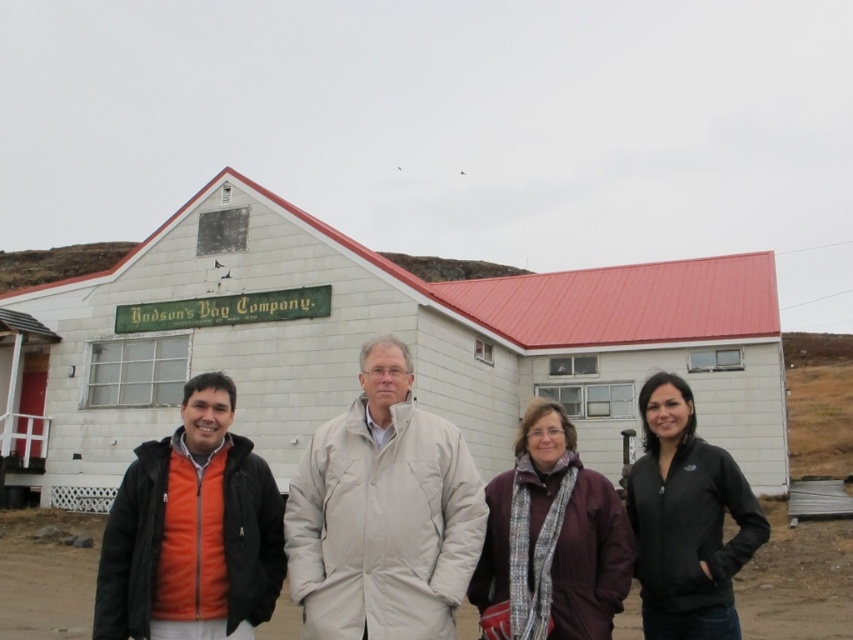
Which is behind, point (364, 522) or point (495, 552)?

The point (495, 552) is more distant.

Can you confirm if beige fabric coat at center is positioned to the right of purple woolen scarf at center?

Incorrect, beige fabric coat at center is not on the right side of purple woolen scarf at center.

Image resolution: width=853 pixels, height=640 pixels. Find the location of `beige fabric coat at center`. beige fabric coat at center is located at coordinates (383, 513).

Does white brick building at center have a lesser width compared to orange fleece jacket at lower left?

No, white brick building at center is not thinner than orange fleece jacket at lower left.

What do you see at coordinates (376, 332) in the screenshot?
I see `white brick building at center` at bounding box center [376, 332].

Is point (209, 301) closer to camera compared to point (216, 472)?

No, (209, 301) is further to viewer.

Where is `white brick building at center`? white brick building at center is located at coordinates (376, 332).

Measure the distance from beige fabric coat at center to black softshell jacket at right.

They are 21.38 feet apart.

Which is above, beige fabric coat at center or black softshell jacket at right?

beige fabric coat at center

Which is in front, point (384, 467) or point (671, 600)?

Point (671, 600) is in front.

You are a GUI agent. You are given a task and a screenshot of the screen. Output one action in this format:
    pyautogui.click(x=<x>, y=<y>)
    Task: Click on the beige fabric coat at center
    
    Given the screenshot: What is the action you would take?
    [383, 513]